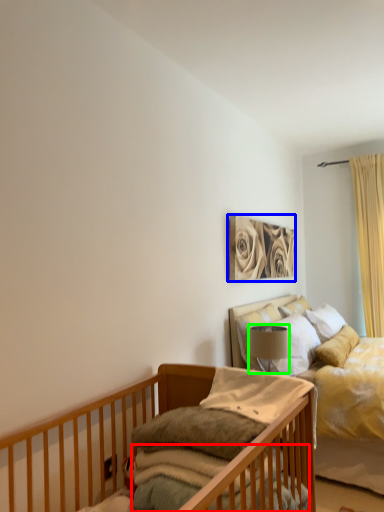
Question: Which object is positioned closest to mattress (highlighted by a red box)? Select from picture frame (highlighted by a blue box) and lamp (highlighted by a green box).

Choices:
 (A) picture frame
 (B) lamp

Answer: (B)